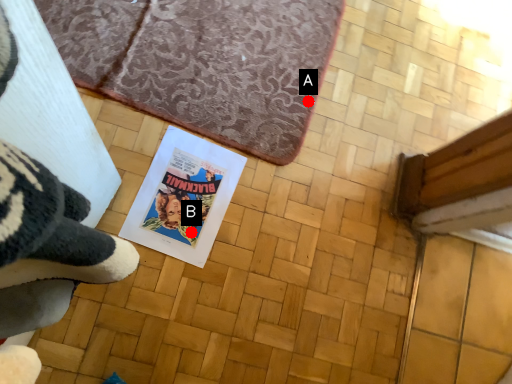
Question: Two points are circled on the image, labeled by A and B beside each circle. Which point appears farthest from the camera in this image?

Choices:
 (A) A is further
 (B) B is further

Answer: (A)